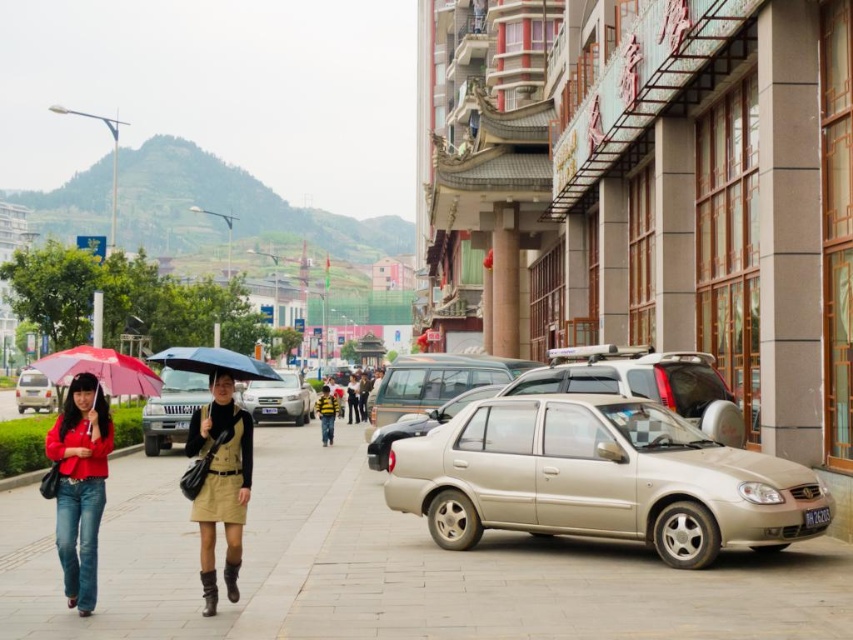
You are standing on the sidewalk in the scene and want to take a photo of both point (111, 364) and point (332, 420) in your frame. Which point should you focus on first to ensure both are in focus?

You should focus on point (111, 364) first because it is closer to the camera than point (332, 420). By focusing on the closer point, the farther point will also be within the depth of field, ensuring both are in focus.

You are a delivery person needing to place a small package on the sidewalk. The package must be placed where there is enough space between the matte red jacket at lower left and the silver metallic sedan at center. Is there enough space for the package?

The matte red jacket at lower left occupies less space than the silver metallic sedan at center, so there is sufficient space between them to place the small package.

Based on the photo, you are standing on the sidewalk and want to take a photo of the silver metallic sedan at center without including the matte red jacket at lower left in the frame. Is this possible given their positions?

The matte red jacket at lower left is closer to the viewer than the silver metallic sedan at center, so it would block the view of the sedan. Therefore, it is not possible to take a photo of the silver metallic sedan at center without including the matte red jacket at lower left in the frame.